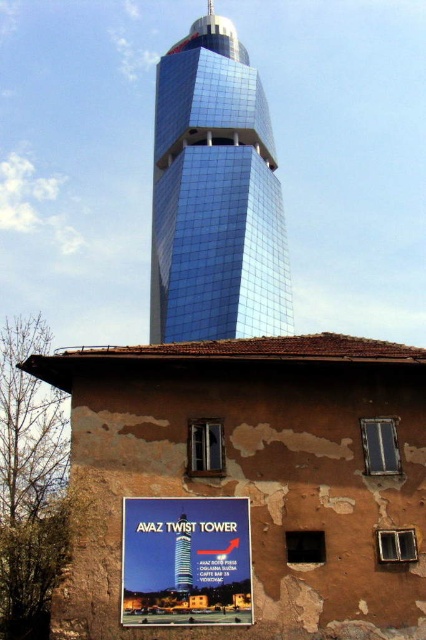
You are an architect evaluating the visual impact of the two structures in the scene. Given that the shiny glass tower at center is a proposed addition, and the matte plastic sign at center represents a scale model of an existing building, which one would appear more dominant in the final design?

The shiny glass tower at center would appear more dominant in the final design because it is bigger than the matte plastic sign at center.